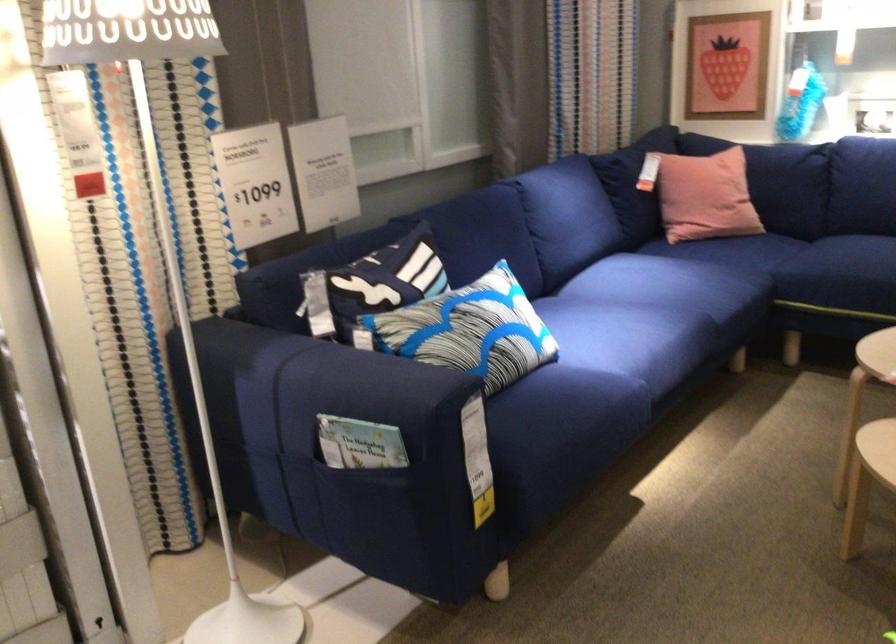
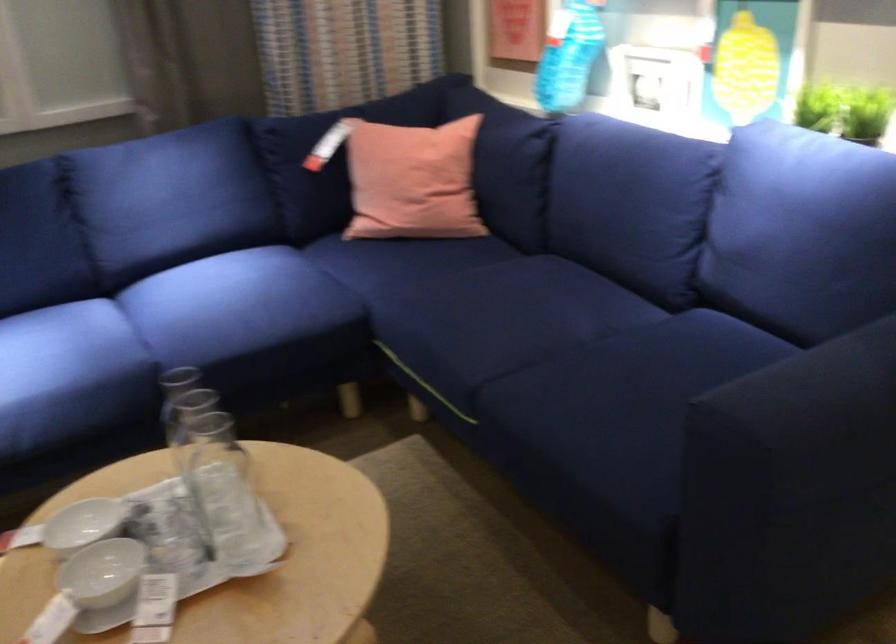
In a continuous first-person perspective shot, in which direction is the camera moving?

The movement direction of the cameraman is right, forward.